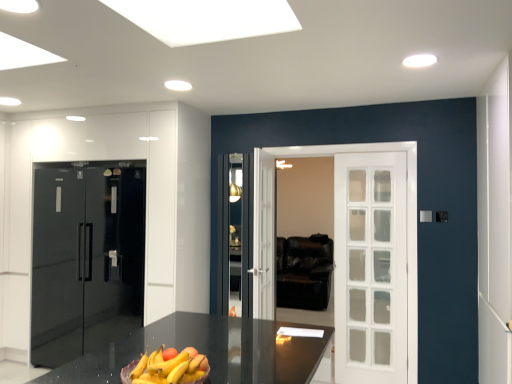
Question: Is black glossy refrigerator at left oriented towards yellow matte bananas at center?

Choices:
 (A) yes
 (B) no

Answer: (B)

Question: Can you confirm if black glossy refrigerator at left is taller than yellow matte bananas at center?

Choices:
 (A) no
 (B) yes

Answer: (B)

Question: From a real-world perspective, is black glossy refrigerator at left beneath yellow matte bananas at center?

Choices:
 (A) no
 (B) yes

Answer: (A)

Question: Is black glossy refrigerator at left oriented away from yellow matte bananas at center?

Choices:
 (A) yes
 (B) no

Answer: (B)

Question: Is black glossy refrigerator at left shorter than yellow matte bananas at center?

Choices:
 (A) yes
 (B) no

Answer: (B)

Question: Can you confirm if black glossy refrigerator at left is thinner than yellow matte bananas at center?

Choices:
 (A) no
 (B) yes

Answer: (A)

Question: From a real-world perspective, is yellow matte bananas at center physically below black glossy refrigerator at left?

Choices:
 (A) no
 (B) yes

Answer: (B)

Question: Is yellow matte bananas at center behind black glossy refrigerator at left?

Choices:
 (A) no
 (B) yes

Answer: (A)

Question: From the image's perspective, is yellow matte bananas at center located beneath black glossy refrigerator at left?

Choices:
 (A) yes
 (B) no

Answer: (B)

Question: Is yellow matte bananas at center aimed at black glossy refrigerator at left?

Choices:
 (A) no
 (B) yes

Answer: (A)

Question: Can you confirm if yellow matte bananas at center is bigger than black glossy refrigerator at left?

Choices:
 (A) yes
 (B) no

Answer: (B)

Question: Are yellow matte bananas at center and black glossy refrigerator at left making contact?

Choices:
 (A) no
 (B) yes

Answer: (A)

Question: From a real-world perspective, is black glossy refrigerator at left positioned above or below yellow matte bananas at center?

Choices:
 (A) below
 (B) above

Answer: (B)